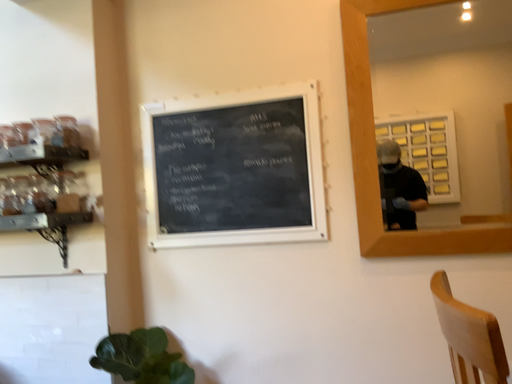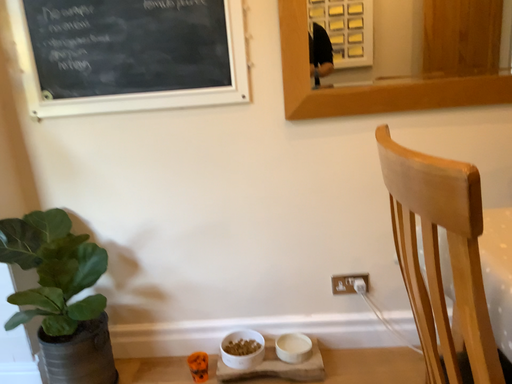
Question: Which way did the camera rotate in the video?

Choices:
 (A) rotated upward
 (B) rotated downward

Answer: (B)